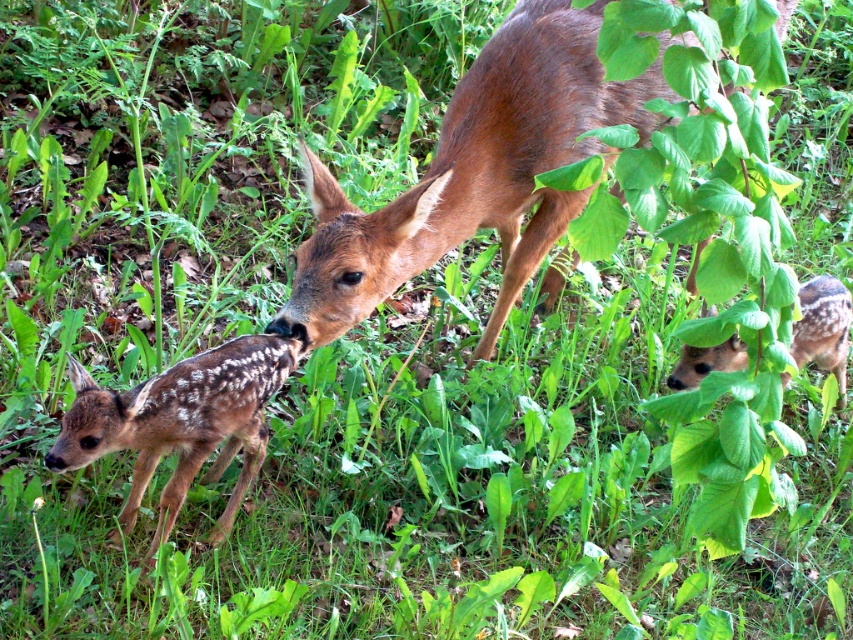
Question: Does brown furry deer at center have a greater width compared to brown speckled fawn at lower left?

Choices:
 (A) no
 (B) yes

Answer: (B)

Question: Observing the image, what is the correct spatial positioning of brown furry deer at center in reference to brown speckled fawn at lower left?

Choices:
 (A) right
 (B) left

Answer: (A)

Question: Which point is farther to the camera?

Choices:
 (A) (193, 381)
 (B) (583, 10)

Answer: (B)

Question: Which point appears closest to the camera in this image?

Choices:
 (A) (135, 506)
 (B) (549, 74)

Answer: (A)

Question: Is brown furry deer at center smaller than brown speckled fawn at lower left?

Choices:
 (A) no
 (B) yes

Answer: (A)